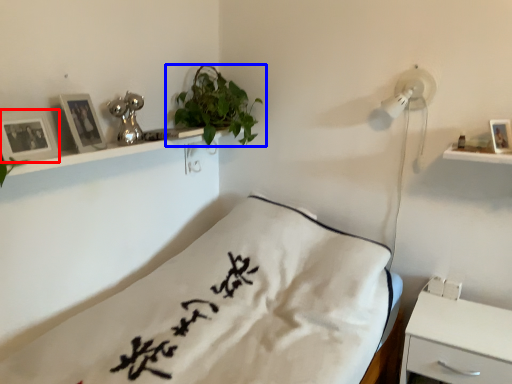
Question: Which of the following is the farthest to the observer, picture frame (highlighted by a red box) or houseplant (highlighted by a blue box)?

Choices:
 (A) picture frame
 (B) houseplant

Answer: (B)